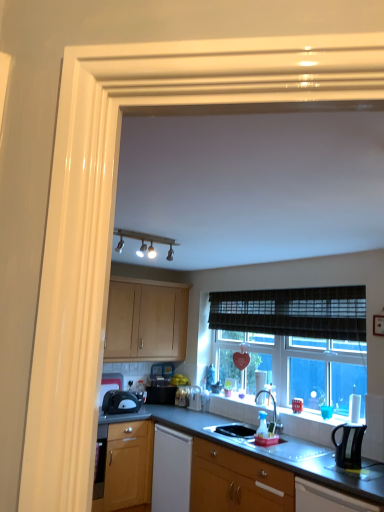
Question: Should I look upward or downward to see black matte sink at center, marked as the second sink in a front-to-back arrangement?

Choices:
 (A) down
 (B) up

Answer: (A)

Question: From a real-world perspective, is matte white track lights at upper center positioned over black matte sink at center, marked as the second sink in a front-to-back arrangement, based on gravity?

Choices:
 (A) no
 (B) yes

Answer: (B)

Question: Is matte white track lights at upper center positioned before black matte sink at center, marked as the second sink in a front-to-back arrangement?

Choices:
 (A) yes
 (B) no

Answer: (A)

Question: Considering the relative sizes of matte white track lights at upper center and black matte sink at center, marked as the second sink in a front-to-back arrangement, in the image provided, is matte white track lights at upper center thinner than black matte sink at center, marked as the second sink in a front-to-back arrangement,?

Choices:
 (A) no
 (B) yes

Answer: (B)

Question: Considering the relative sizes of matte white track lights at upper center and black matte sink at center, positioned as the first sink in back-to-front order, in the image provided, is matte white track lights at upper center bigger than black matte sink at center, positioned as the first sink in back-to-front order,?

Choices:
 (A) yes
 (B) no

Answer: (A)

Question: Is black matte sink at center, marked as the second sink in a front-to-back arrangement, inside matte white track lights at upper center?

Choices:
 (A) yes
 (B) no

Answer: (B)

Question: From a real-world perspective, does matte white track lights at upper center sit lower than black matte sink at center, positioned as the first sink in back-to-front order?

Choices:
 (A) no
 (B) yes

Answer: (A)

Question: Is matte black toaster at lower right, the third cabinetry viewed from the left, closer to the viewer compared to white glossy sink at lower center, the 2th sink from the back?

Choices:
 (A) yes
 (B) no

Answer: (A)

Question: From a real-world perspective, is matte black toaster at lower right, the third cabinetry viewed from the left, under white glossy sink at lower center, the 1th sink from the front?

Choices:
 (A) no
 (B) yes

Answer: (B)

Question: Could white glossy sink at lower center, the 1th sink from the front, be considered to be inside matte black toaster at lower right, the 2th cabinetry in the top-to-bottom sequence?

Choices:
 (A) no
 (B) yes

Answer: (A)

Question: Does matte black toaster at lower right, placed as the 3th cabinetry when sorted from back to front, have a larger size compared to white glossy sink at lower center, the 2th sink from the back?

Choices:
 (A) yes
 (B) no

Answer: (A)

Question: Is matte black toaster at lower right, placed as the 3th cabinetry when sorted from back to front, in contact with white glossy sink at lower center, the 2th sink from the back?

Choices:
 (A) yes
 (B) no

Answer: (B)

Question: Is matte black toaster at lower right, which is the 1th cabinetry from front to back, shorter than white glossy sink at lower center, the 2th sink from the back?

Choices:
 (A) yes
 (B) no

Answer: (B)

Question: Is white glossy sink at lower center, the 1th sink from the front, shorter than satin nickel faucet at center?

Choices:
 (A) no
 (B) yes

Answer: (B)